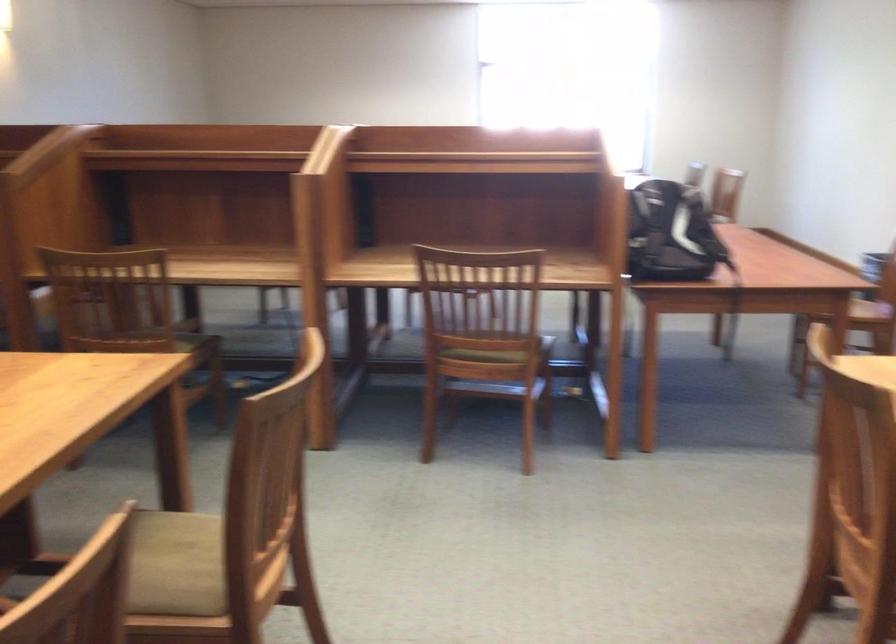
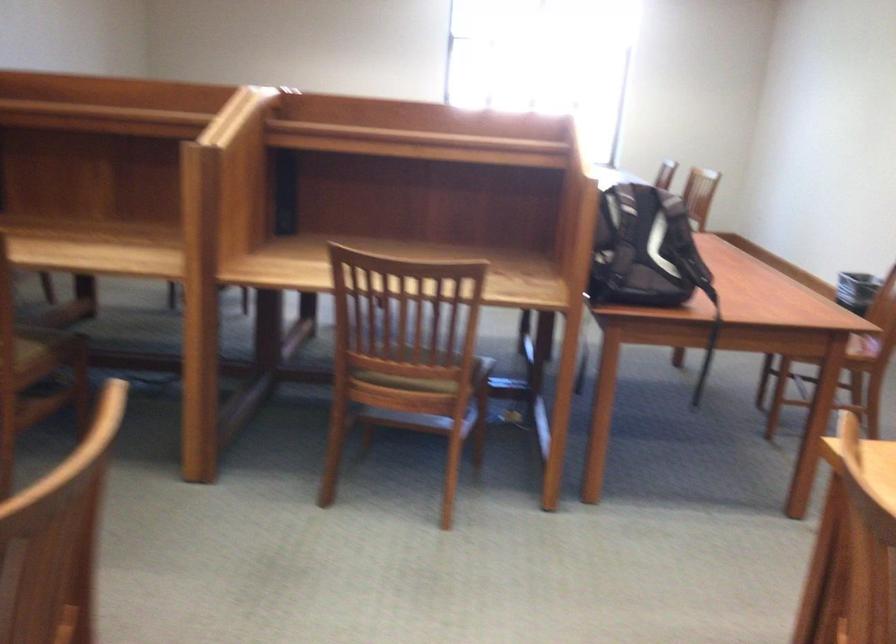
Where in the second image is the point corresponding to the point at 194,351 from the first image?

(46, 348)